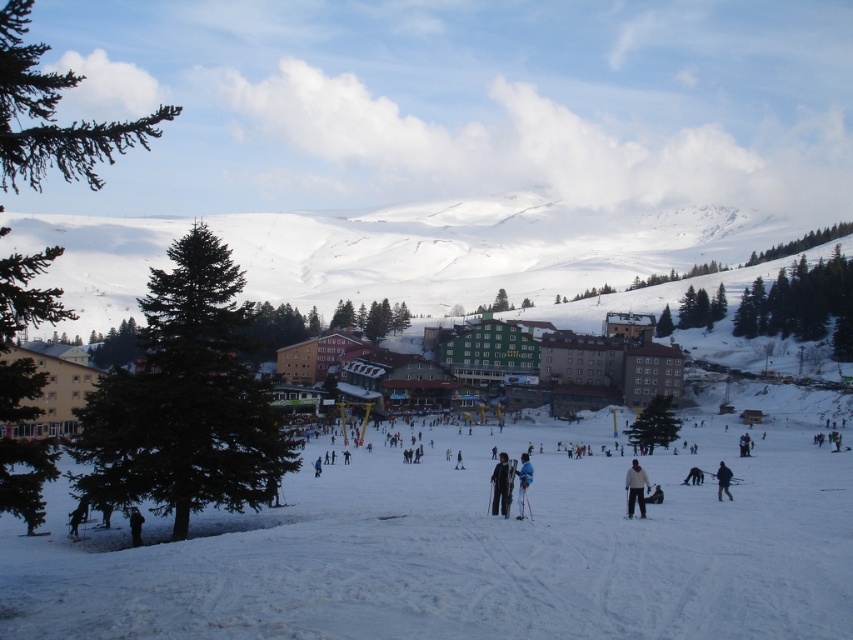
Can you confirm if white snow pants at center is shorter than black fabric person at lower left?

No, white snow pants at center is not shorter than black fabric person at lower left.

Can you confirm if white snow pants at center is positioned to the left of black fabric person at lower left?

Incorrect, white snow pants at center is not on the left side of black fabric person at lower left.

Does point (527, 477) come closer to viewer compared to point (135, 525)?

No, (527, 477) is further to viewer.

Where is `white snow pants at center`? This screenshot has height=640, width=853. white snow pants at center is located at coordinates (523, 483).

Who is more distant from viewer, (509, 468) or (135, 516)?

Positioned behind is point (509, 468).

The width and height of the screenshot is (853, 640). I want to click on black ski suit at center, so click(x=502, y=484).

The image size is (853, 640). Identify the location of black ski suit at center. (502, 484).

Does white matte jacket at lower center appear on the left side of black fabric person at lower left?

Incorrect, white matte jacket at lower center is not on the left side of black fabric person at lower left.

Is point (630, 488) positioned behind point (135, 541)?

Yes, point (630, 488) is behind point (135, 541).

I want to click on white matte jacket at lower center, so click(636, 486).